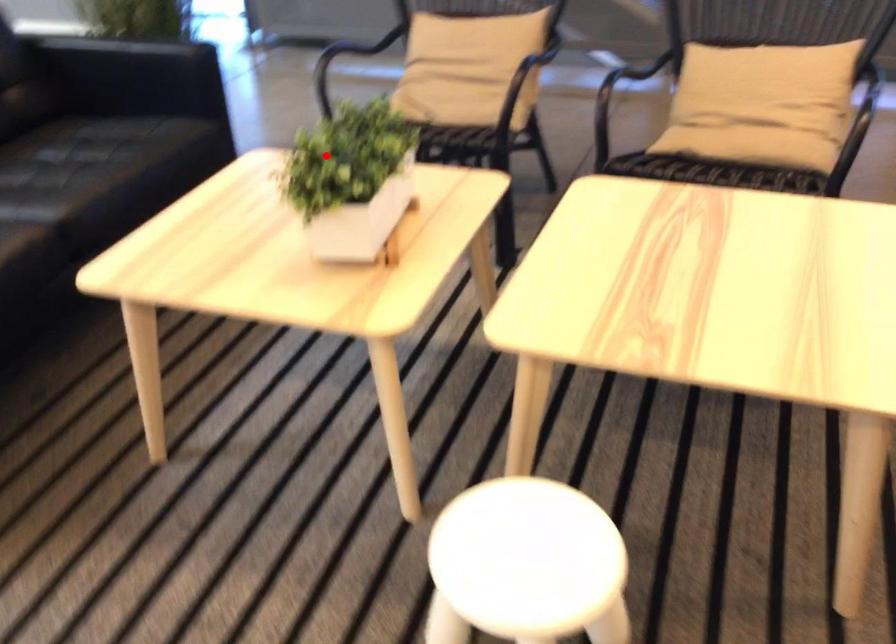
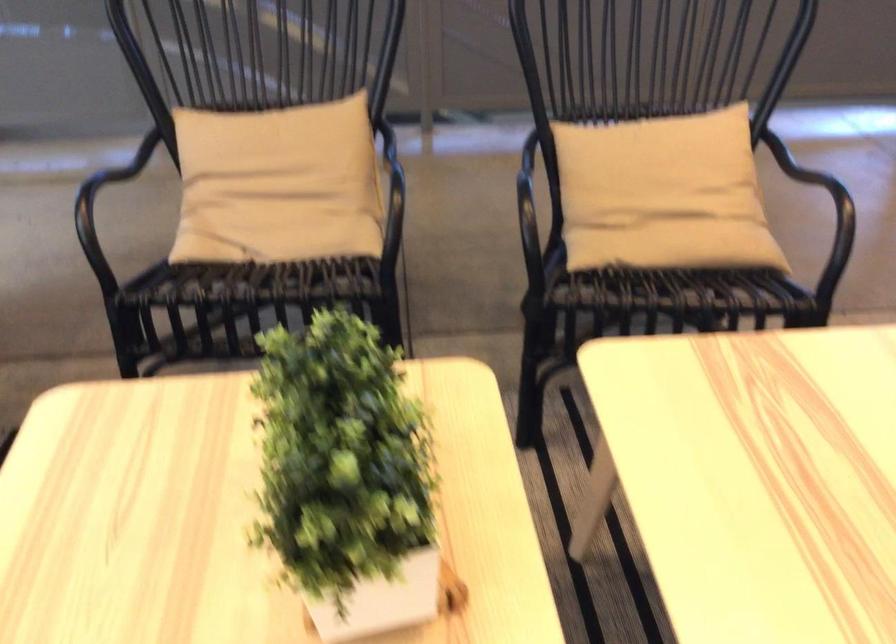
Question: I am providing you with two images of the same scene from different viewpoints. A red point is marked on the first image. Can you still see the location of the red point in image 2?

Choices:
 (A) Yes
 (B) No

Answer: (A)